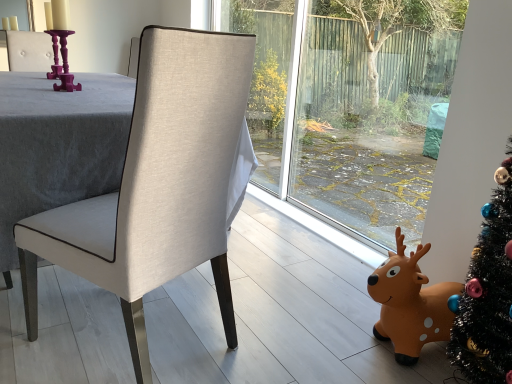
Describe the element at coordinates (157, 185) in the screenshot. I see `matte beige fabric chair at center` at that location.

Identify the location of orange rubber reindeer at lower right. (410, 303).

Locate an element on the screen. matte beige fabric chair at center is located at coordinates (157, 185).

In the image, is matte beige fabric chair at center positioned in front of or behind purple glossy candle holder at upper left?

matte beige fabric chair at center is in front of purple glossy candle holder at upper left.

Are matte beige fabric chair at center and purple glossy candle holder at upper left beside each other?

matte beige fabric chair at center and purple glossy candle holder at upper left are clearly separated.

Identify the location of chair that is under the purple glossy candle holder at upper left (from a real-world perspective). (157, 185).

From the image's perspective, between matte beige fabric chair at center and purple glossy candle holder at upper left, which one is located above?

purple glossy candle holder at upper left, from the image's perspective.

Can you confirm if purple glossy candle holder at upper left is smaller than orange rubber reindeer at lower right?

Yes.

Where is `deer below the purple glossy candle holder at upper left (from a real-world perspective)`? deer below the purple glossy candle holder at upper left (from a real-world perspective) is located at coordinates (410, 303).

Is purple glossy candle holder at upper left turned away from orange rubber reindeer at lower right?

No, purple glossy candle holder at upper left's orientation is not away from orange rubber reindeer at lower right.

Between purple glossy candle holder at upper left and matte beige fabric chair at center, which one appears on the left side from the viewer's perspective?

From the viewer's perspective, purple glossy candle holder at upper left appears more on the left side.

Which is closer to the camera, (64,69) or (114,260)?

Clearly, point (64,69) is more distant from the camera than point (114,260).

From the image's perspective, is purple glossy candle holder at upper left above or below matte beige fabric chair at center?

From the image's perspective, purple glossy candle holder at upper left appears above matte beige fabric chair at center.

Who is more distant, orange rubber reindeer at lower right or matte beige fabric chair at center?

orange rubber reindeer at lower right is further away from the camera.

Is orange rubber reindeer at lower right beside matte beige fabric chair at center?

No, orange rubber reindeer at lower right is not next to matte beige fabric chair at center.

From a real-world perspective, does orange rubber reindeer at lower right sit lower than matte beige fabric chair at center?

Yes, from a real-world perspective, orange rubber reindeer at lower right is under matte beige fabric chair at center.

Where is `deer behind the matte beige fabric chair at center`? deer behind the matte beige fabric chair at center is located at coordinates (410, 303).

Is orange rubber reindeer at lower right positioned in front of purple glossy candle holder at upper left?

Yes, the depth of orange rubber reindeer at lower right is less than that of purple glossy candle holder at upper left.

Does orange rubber reindeer at lower right have a smaller size compared to purple glossy candle holder at upper left?

No.

Which of these two, orange rubber reindeer at lower right or purple glossy candle holder at upper left, stands taller?

Standing taller between the two is orange rubber reindeer at lower right.

Between orange rubber reindeer at lower right and purple glossy candle holder at upper left, which one has larger width?

orange rubber reindeer at lower right is wider.

From a real-world perspective, is matte beige fabric chair at center on orange rubber reindeer at lower right?

Yes, from a real-world perspective, matte beige fabric chair at center is over orange rubber reindeer at lower right

Which of these two, matte beige fabric chair at center or orange rubber reindeer at lower right, is thinner?

orange rubber reindeer at lower right.

Which of these two, matte beige fabric chair at center or orange rubber reindeer at lower right, is smaller?

orange rubber reindeer at lower right is smaller.

Can you confirm if matte beige fabric chair at center is positioned to the left of orange rubber reindeer at lower right?

Correct, you'll find matte beige fabric chair at center to the left of orange rubber reindeer at lower right.

I want to click on candle holder behind the matte beige fabric chair at center, so click(x=63, y=63).

Image resolution: width=512 pixels, height=384 pixels. What are the coordinates of `deer in front of the purple glossy candle holder at upper left` in the screenshot? It's located at (410, 303).

Which object lies nearer to the anchor point matte beige fabric chair at center, orange rubber reindeer at lower right or purple glossy candle holder at upper left?

The object closer to matte beige fabric chair at center is orange rubber reindeer at lower right.

Looking at this image, when comparing their distances from purple glossy candle holder at upper left, does orange rubber reindeer at lower right or matte beige fabric chair at center seem further?

Based on the image, orange rubber reindeer at lower right appears to be further to purple glossy candle holder at upper left.

Considering their positions, is purple glossy candle holder at upper left positioned further to orange rubber reindeer at lower right than matte beige fabric chair at center?

Among the two, purple glossy candle holder at upper left is located further to orange rubber reindeer at lower right.

Which object lies nearer to the anchor point purple glossy candle holder at upper left, matte beige fabric chair at center or orange rubber reindeer at lower right?

Among the two, matte beige fabric chair at center is located nearer to purple glossy candle holder at upper left.

From the image, which object appears to be farther from orange rubber reindeer at lower right, matte beige fabric chair at center or purple glossy candle holder at upper left?

purple glossy candle holder at upper left is positioned further to the anchor orange rubber reindeer at lower right.

When comparing their distances from matte beige fabric chair at center, does purple glossy candle holder at upper left or orange rubber reindeer at lower right seem closer?

Based on the image, orange rubber reindeer at lower right appears to be nearer to matte beige fabric chair at center.

You are a GUI agent. You are given a task and a screenshot of the screen. Output one action in this format:
    pyautogui.click(x=<x>, y=<y>)
    Task: Click on the chair located between purple glossy candle holder at upper left and orange rubber reindeer at lower right in the left-right direction
    Image resolution: width=512 pixels, height=384 pixels.
    Given the screenshot: What is the action you would take?
    pyautogui.click(x=157, y=185)